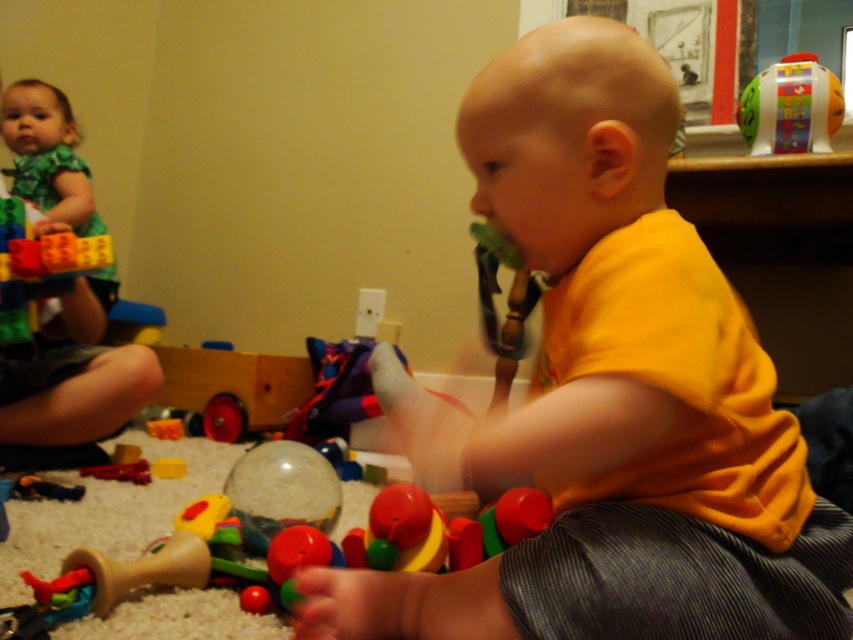
You are a parent trying to organize the play area. You need to place the green fabric dress at upper left and the plastic abc book at upper right on a shelf. Which item should you place first if you want to arrange them from widest to narrowest?

The green fabric dress at upper left should be placed first because it might be wider than the plastic abc book at upper right.

You are a parent looking for a toy for your child. You see the green fabric dress at upper left and the plastic abc book at upper right. Which one is bigger?

The green fabric dress at upper left is larger than the plastic abc book at upper right.

You are a parent trying to choose an outfit for your child. You have two options in the image, the yellow matte shirt at center and the green fabric dress at upper left. Which one would be more suitable for a day out if you want something that covers more body area?

The yellow matte shirt at center is larger in size than the green fabric dress at upper left, so it would be more suitable for a day out if you want something that covers more body area.